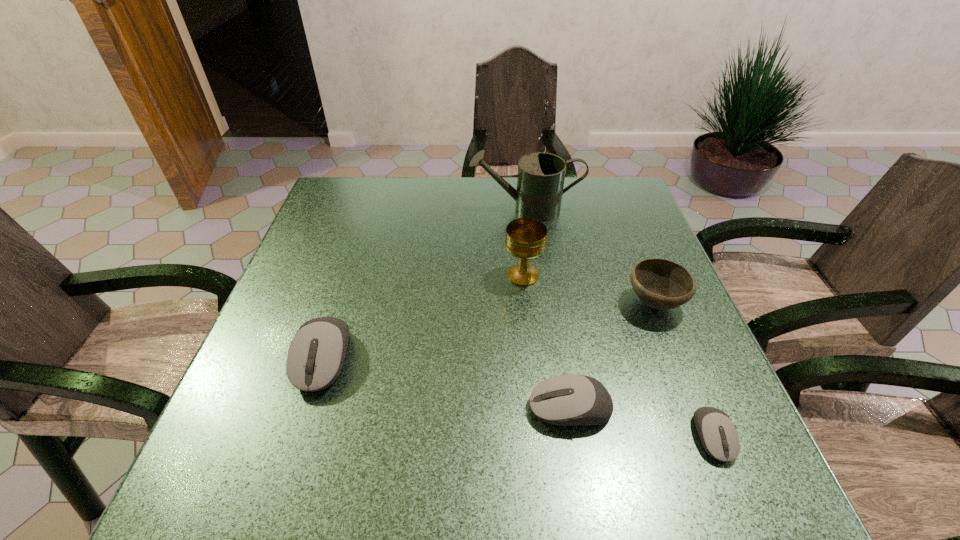
What are the coordinates of `free spot located on the wheel side of the fifth tallest object` in the screenshot? It's located at (409, 408).

You are a GUI agent. You are given a task and a screenshot of the screen. Output one action in this format:
    pyautogui.click(x=<x>, y=<y>)
    Task: Click on the blank area located on the wheel side of the fifth tallest object
    Image resolution: width=960 pixels, height=540 pixels.
    Given the screenshot: What is the action you would take?
    pos(397,408)

Where is `vacant space located 0.140m on the wheel side of the fifth tallest object`? Image resolution: width=960 pixels, height=540 pixels. vacant space located 0.140m on the wheel side of the fifth tallest object is located at coordinates (452, 408).

Locate an element on the screen. This screenshot has height=540, width=960. vacant space located 0.230m on the front of the chalice is located at coordinates (533, 371).

Image resolution: width=960 pixels, height=540 pixels. Find the location of `free space located with the spout on the watering can`. free space located with the spout on the watering can is located at coordinates (443, 209).

This screenshot has width=960, height=540. Identify the location of blank area located 0.310m with the spout on the watering can. (362, 209).

The height and width of the screenshot is (540, 960). In order to click on free region located with the spout on the watering can in this screenshot , I will do `click(352, 209)`.

The width and height of the screenshot is (960, 540). I want to click on blank space located on the left of the fourth shortest object, so tap(540, 303).

Image resolution: width=960 pixels, height=540 pixels. Find the location of `object located in the far edge section of the desktop`. object located in the far edge section of the desktop is located at coordinates (540, 180).

The width and height of the screenshot is (960, 540). Identify the location of object that is at the left edge. (316, 354).